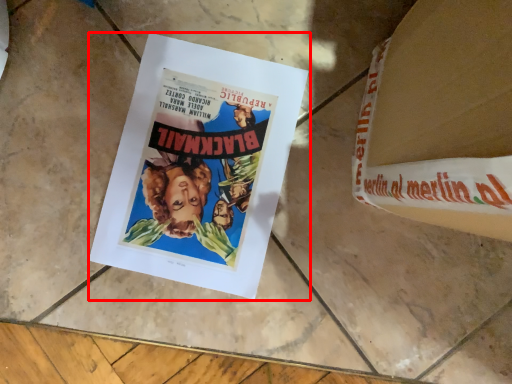
Question: From the image's perspective, considering the relative positions of poster (annotated by the red box) and paperback book in the image provided, where is poster (annotated by the red box) located with respect to the staircase?

Choices:
 (A) below
 (B) above

Answer: (A)